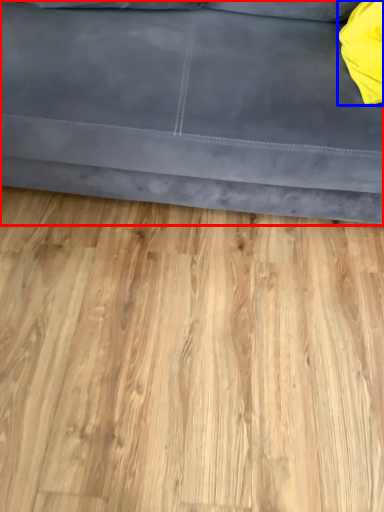
Question: Which point is closer to the camera, studio couch (highlighted by a red box) or pillow (highlighted by a blue box)?

Choices:
 (A) studio couch
 (B) pillow

Answer: (A)